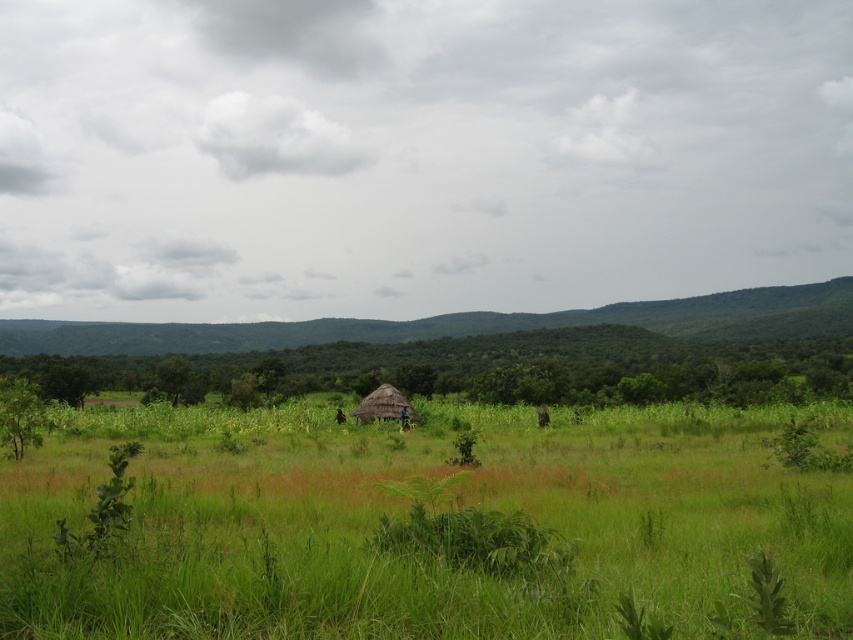
Question: Among these points, which one is farthest from the camera?

Choices:
 (A) (525, 564)
 (B) (367, 417)

Answer: (B)

Question: Is green grassy field at center to the right of thatched straw hut at center from the viewer's perspective?

Choices:
 (A) no
 (B) yes

Answer: (A)

Question: Is green grassy field at center positioned behind thatched straw hut at center?

Choices:
 (A) no
 (B) yes

Answer: (A)

Question: Does green grassy field at center lie in front of thatched straw hut at center?

Choices:
 (A) no
 (B) yes

Answer: (B)

Question: Which object appears farthest from the camera in this image?

Choices:
 (A) green grassy field at center
 (B) thatched straw hut at center

Answer: (B)